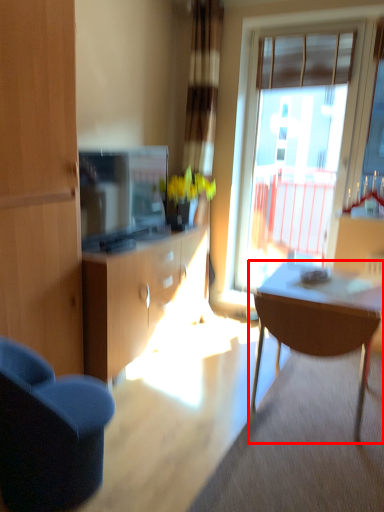
Question: From the image, what is the correct spatial relationship of kitchen & dining room table (annotated by the red box) in relation to window?

Choices:
 (A) right
 (B) left

Answer: (B)